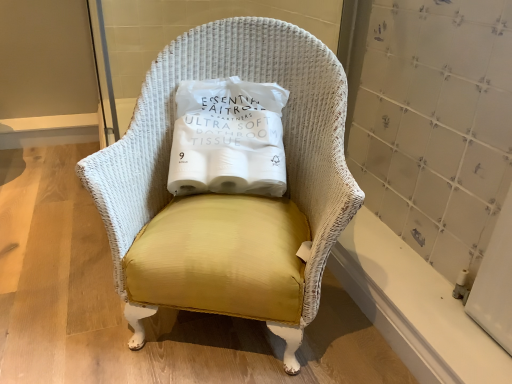
The width and height of the screenshot is (512, 384). Describe the element at coordinates (228, 138) in the screenshot. I see `yellow fabric pillow at center` at that location.

Image resolution: width=512 pixels, height=384 pixels. Identify the location of yellow fabric pillow at center. (228, 138).

What is the approximate width of white wicker chair at center?

The width of white wicker chair at center is 25.12 inches.

Where is `white wicker chair at center`? This screenshot has height=384, width=512. white wicker chair at center is located at coordinates (285, 140).

The width and height of the screenshot is (512, 384). What do you see at coordinates (285, 140) in the screenshot?
I see `white wicker chair at center` at bounding box center [285, 140].

You are a GUI agent. You are given a task and a screenshot of the screen. Output one action in this format:
    pyautogui.click(x=<x>, y=<y>)
    Task: Click on the yellow fabric pillow at center
    The width and height of the screenshot is (512, 384).
    Given the screenshot: What is the action you would take?
    pyautogui.click(x=228, y=138)

Is white wicker chair at center to the left or to the right of yellow fabric pillow at center in the image?

In the image, white wicker chair at center appears on the right side of yellow fabric pillow at center.

In the scene shown: Who is more distant, white wicker chair at center or yellow fabric pillow at center?

yellow fabric pillow at center is more distant.

Does point (78, 172) appear closer or farther from the camera than point (250, 88)?

Point (78, 172) appears to be farther away from the viewer than point (250, 88).

From the picture: From the image's perspective, would you say white wicker chair at center is positioned over yellow fabric pillow at center?

No, from the image's perspective, white wicker chair at center is not over yellow fabric pillow at center.

From a real-world perspective, does white wicker chair at center sit lower than yellow fabric pillow at center?

Correct, in the physical world, white wicker chair at center is lower than yellow fabric pillow at center.

Consider the image. Looking at their sizes, would you say white wicker chair at center is wider or thinner than yellow fabric pillow at center?

In the image, white wicker chair at center appears to be wider than yellow fabric pillow at center.

Considering the sizes of objects white wicker chair at center and yellow fabric pillow at center in the image provided, who is shorter, white wicker chair at center or yellow fabric pillow at center?

With less height is yellow fabric pillow at center.

Which of these two, white wicker chair at center or yellow fabric pillow at center, is bigger?

white wicker chair at center.

Can we say white wicker chair at center lies outside yellow fabric pillow at center?

Absolutely, white wicker chair at center is external to yellow fabric pillow at center.

Are white wicker chair at center and yellow fabric pillow at center beside each other?

They are not placed beside each other.

Is white wicker chair at center looking in the opposite direction of yellow fabric pillow at center?

Absolutely, white wicker chair at center is directed away from yellow fabric pillow at center.

Can you tell me how much white wicker chair at center and yellow fabric pillow at center differ in facing direction?

The angle between the facing direction of white wicker chair at center and the facing direction of yellow fabric pillow at center is 11.4 degrees.

The width and height of the screenshot is (512, 384). I want to click on pillow on the left of white wicker chair at center, so click(228, 138).

Is yellow fabric pillow at center to the left of white wicker chair at center from the viewer's perspective?

Yes.

Relative to white wicker chair at center, is yellow fabric pillow at center in front or behind?

yellow fabric pillow at center is positioned farther from the viewer than white wicker chair at center.

Considering the points (221, 99) and (298, 52), which point is behind, point (221, 99) or point (298, 52)?

The point (221, 99) is more distant.

From the image's perspective, who appears lower, yellow fabric pillow at center or white wicker chair at center?

white wicker chair at center.

From a real-world perspective, is yellow fabric pillow at center physically above white wicker chair at center?

Yes, from a real-world perspective, yellow fabric pillow at center is over white wicker chair at center

Is yellow fabric pillow at center wider than white wicker chair at center?

No, yellow fabric pillow at center is not wider than white wicker chair at center.

Can you confirm if yellow fabric pillow at center is shorter than white wicker chair at center?

Yes.

Considering the sizes of objects yellow fabric pillow at center and white wicker chair at center in the image provided, who is bigger, yellow fabric pillow at center or white wicker chair at center?

white wicker chair at center is bigger.

Which is correct: yellow fabric pillow at center is inside white wicker chair at center, or outside of it?

yellow fabric pillow at center lies within the bounds of white wicker chair at center.

Would you consider yellow fabric pillow at center to be distant from white wicker chair at center?

No, yellow fabric pillow at center is not far away from white wicker chair at center.

Could you tell me if yellow fabric pillow at center is turned towards white wicker chair at center?

Yes, yellow fabric pillow at center is turned towards white wicker chair at center.

How distant is yellow fabric pillow at center from white wicker chair at center?

yellow fabric pillow at center and white wicker chair at center are 5.51 inches apart.

You are a GUI agent. You are given a task and a screenshot of the screen. Output one action in this format:
    pyautogui.click(x=<x>, y=<y>)
    Task: Click on the chair directly beneath the yellow fabric pillow at center (from a real-world perspective)
    Image resolution: width=512 pixels, height=384 pixels.
    Given the screenshot: What is the action you would take?
    pyautogui.click(x=285, y=140)

What are the coordinates of `chair in front of the yellow fabric pillow at center` in the screenshot? It's located at (285, 140).

You are a GUI agent. You are given a task and a screenshot of the screen. Output one action in this format:
    pyautogui.click(x=<x>, y=<y>)
    Task: Click on the pillow above the white wicker chair at center (from the image's perspective)
    This screenshot has width=512, height=384.
    Given the screenshot: What is the action you would take?
    pyautogui.click(x=228, y=138)